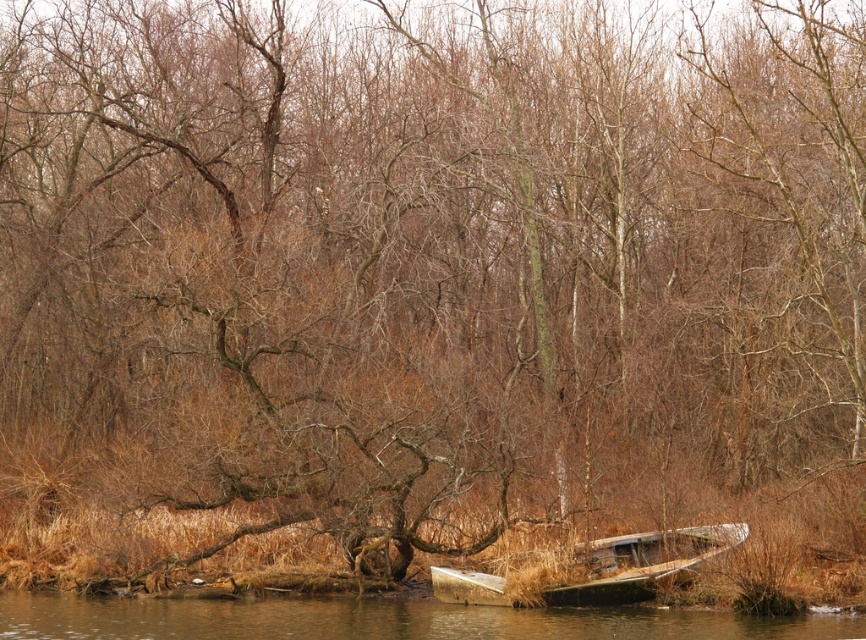
You are a hiker who has come across this riverside scene. You need to cross the river but want to avoid getting your boots wet. Which boat, the brown wooden boat at lower center or the rusty metal boat at lower right, would you choose to step onto first?

You should step onto the brown wooden boat at lower center first because it is positioned under the rusty metal boat at lower right, meaning it is closer to the shore and easier to access without getting your boots wet.

You are a painter standing at the riverside. You want to paint both the brown wooden boat at lower center and the rusty metal boat at lower right. Which boat should you choose if you want to paint the wider one?

The brown wooden boat at lower center is wider than the rusty metal boat at lower right, so you should choose the brown wooden boat at lower center to paint.

Based on the photo, you are a kayaker who needs to navigate between the brown wooden boat at lower center and the rusty metal boat at lower right. Given that your kayak is 3 meters long, can you safely pass through the gap between them?

The distance between the brown wooden boat at lower center and the rusty metal boat at lower right is 4.39 meters. Since your kayak is 3 meters long, it can safely pass through the gap as the distance is greater than the kayak length.